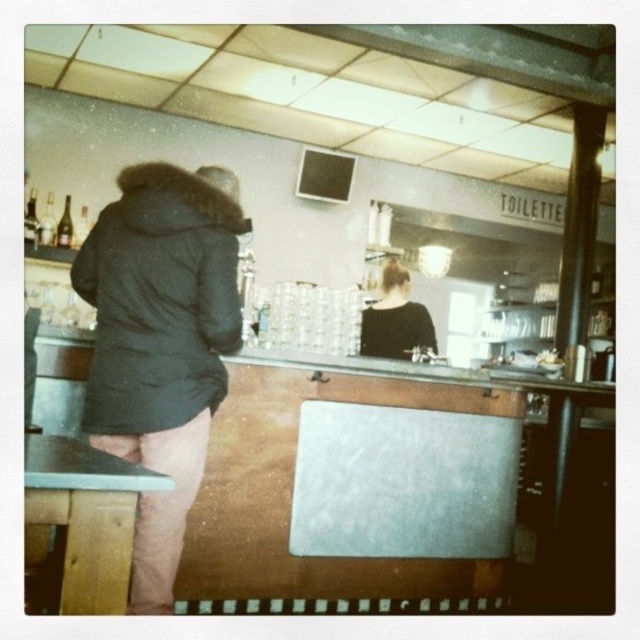
Which of these two, wooden bar stool at lower left or black matte shirt at center, stands taller?

Standing taller between the two is black matte shirt at center.

In the scene shown: Is wooden bar stool at lower left bigger than black matte shirt at center?

Actually, wooden bar stool at lower left might be smaller than black matte shirt at center.

Measure the distance between point (45, 460) and camera.

1.15 meters

You are a GUI agent. You are given a task and a screenshot of the screen. Output one action in this format:
    pyautogui.click(x=<x>, y=<y>)
    Task: Click on the wooden bar stool at lower left
    The image size is (640, 640).
    Given the screenshot: What is the action you would take?
    pyautogui.click(x=84, y=516)

The image size is (640, 640). Describe the element at coordinates (314, 93) in the screenshot. I see `metallic silver exhaust hood at upper center` at that location.

Who is more forward, (x=464, y=148) or (x=45, y=509)?

Positioned in front is point (x=45, y=509).

Where is `metallic silver exhaust hood at upper center`? metallic silver exhaust hood at upper center is located at coordinates (314, 93).

Between point (120, 269) and point (102, 566), which one is positioned behind?

The point (120, 269) is behind.

Who is shorter, dark gray fur-lined coat at center or wooden bar stool at lower left?

Standing shorter between the two is wooden bar stool at lower left.

Describe the element at coordinates (161, 342) in the screenshot. The image size is (640, 640). I see `dark gray fur-lined coat at center` at that location.

Find the location of `dark gray fur-lined coat at center`. dark gray fur-lined coat at center is located at coordinates (161, 342).